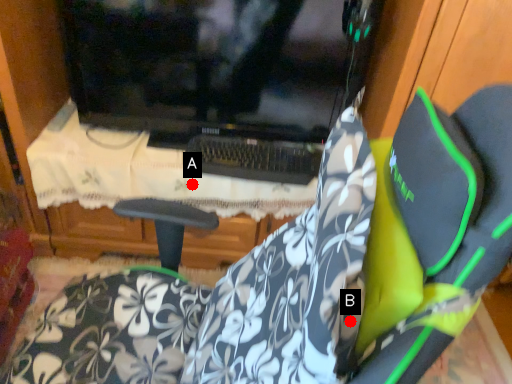
Question: Two points are circled on the image, labeled by A and B beside each circle. Which point is further to the camera?

Choices:
 (A) A is further
 (B) B is further

Answer: (A)